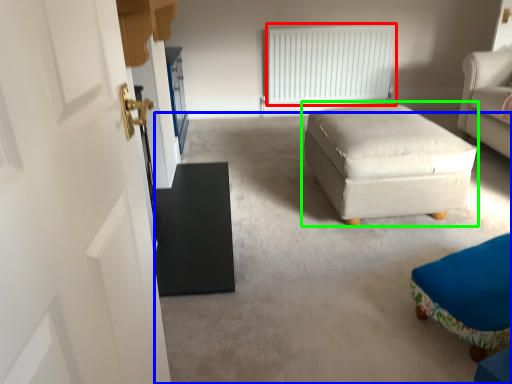
Question: Based on their relative distances, which object is nearer to radiator (highlighted by a red box)? Choose from plain (highlighted by a blue box) and table (highlighted by a green box).

Choices:
 (A) plain
 (B) table

Answer: (B)